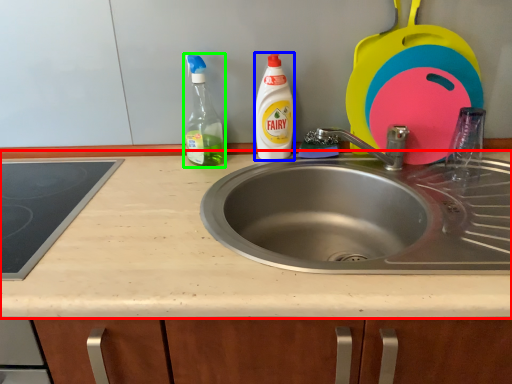
Question: Estimate the real-world distances between objects in this image. Which object is farther from countertop (highlighted by a red box), cleaning product (highlighted by a blue box) or cleaning product (highlighted by a green box)?

Choices:
 (A) cleaning product
 (B) cleaning product

Answer: (A)